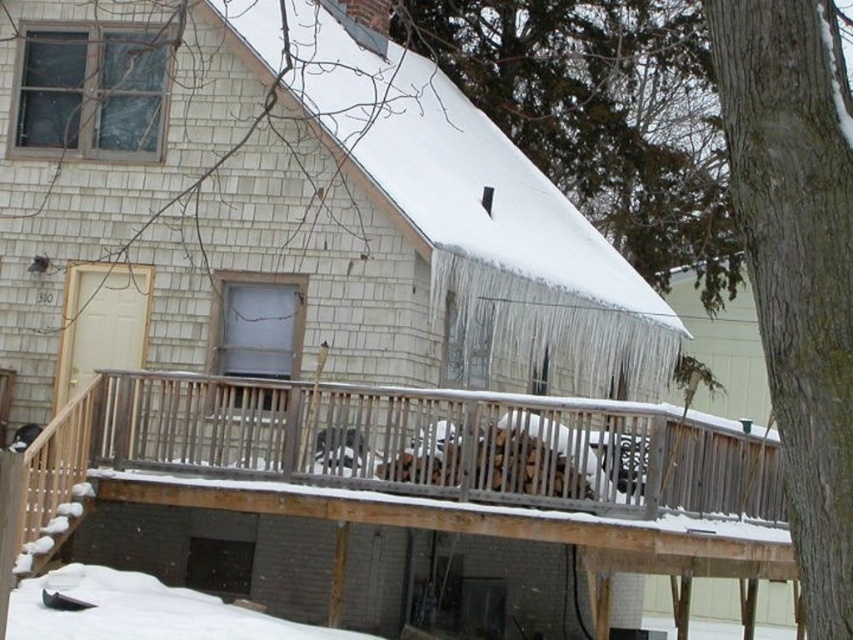
You are standing in front of the house and notice the smooth gray bark at right and the white fluffy snow at lower left. Which object is located higher up in the scene?

The smooth gray bark at right is positioned over the white fluffy snow at lower left, so it is higher up in the scene.